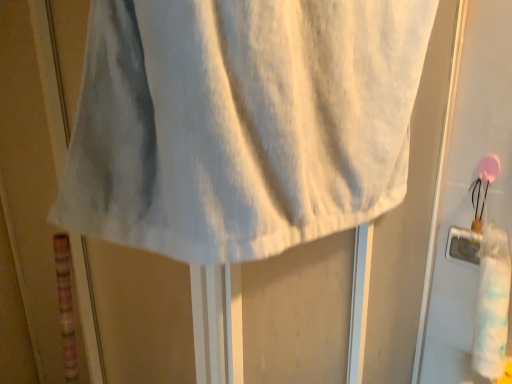
Describe the element at coordinates (241, 122) in the screenshot. I see `white cotton towel at center` at that location.

I want to click on white cotton towel at center, so click(241, 122).

Measure the distance between white cotton towel at center and camera.

The distance of white cotton towel at center from camera is 14.14 inches.

The width and height of the screenshot is (512, 384). I want to click on white cotton towel at center, so (x=241, y=122).